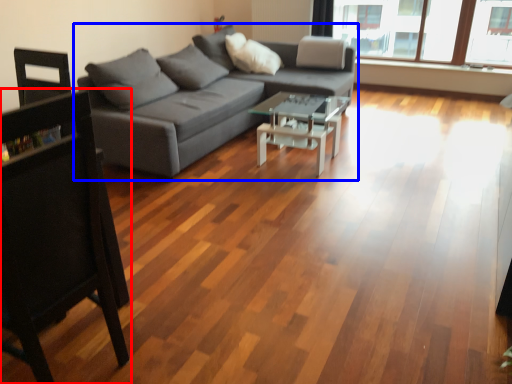
Question: Which point is further to the camera, chair (highlighted by a red box) or studio couch (highlighted by a blue box)?

Choices:
 (A) chair
 (B) studio couch

Answer: (B)